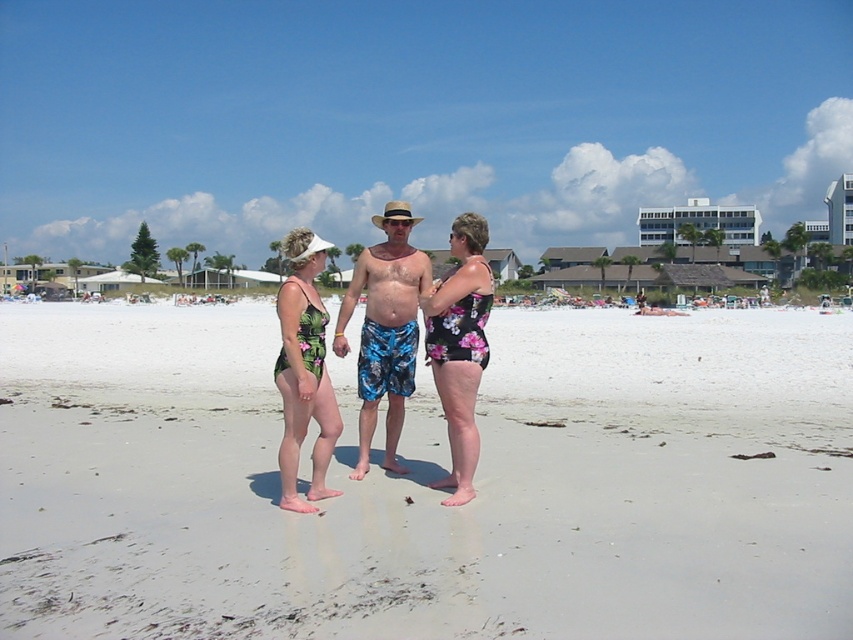
Question: Which of the following is the closest to the observer?

Choices:
 (A) (473, 348)
 (B) (119, 374)
 (C) (393, 355)
 (D) (410, 218)

Answer: (A)

Question: Does green floral swimsuit at center have a lesser width compared to black plastic goggles at center?

Choices:
 (A) yes
 (B) no

Answer: (B)

Question: Is green floral swimsuit at center positioned at the back of black plastic goggles at center?

Choices:
 (A) yes
 (B) no

Answer: (B)

Question: Which of these objects is positioned closest to the white sand at center?

Choices:
 (A) blue printed shorts at center
 (B) floral print swimsuit at center
 (C) black plastic goggles at center

Answer: (A)

Question: Where is blue printed shorts at center located in relation to floral print swimsuit at center in the image?

Choices:
 (A) right
 (B) left

Answer: (B)

Question: Which of the following is the farthest from the observer?

Choices:
 (A) blue printed shorts at center
 (B) green floral swimsuit at center
 (C) floral print swimsuit at center

Answer: (A)